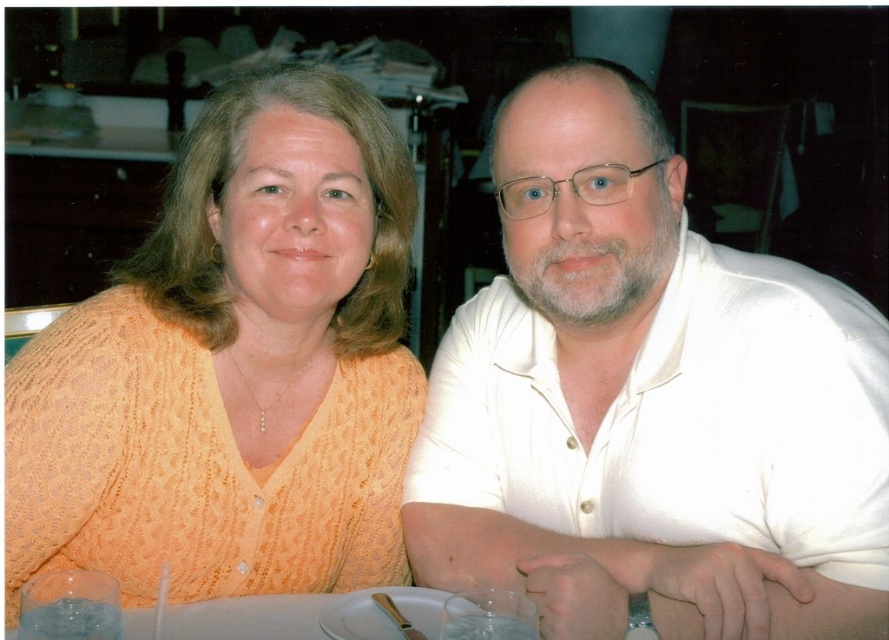
Between white smooth shirt at right and orange knitted sweater at left, which one is positioned lower?

Positioned lower is white smooth shirt at right.

Which is behind, point (845, 609) or point (167, 538)?

The point (167, 538) is more distant.

Find the location of a particular element. Image resolution: width=889 pixels, height=640 pixels. white smooth shirt at right is located at coordinates (649, 401).